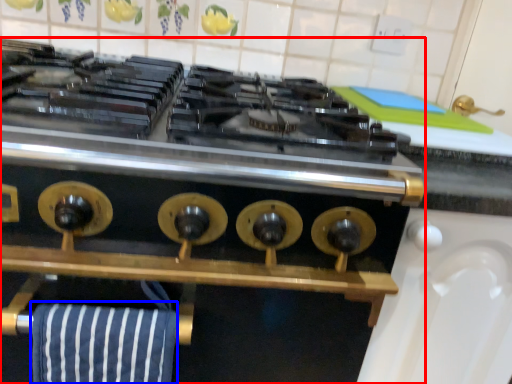
Question: Among these objects, which one is farthest to the camera, kitchen appliance (highlighted by a red box) or beach towel (highlighted by a blue box)?

Choices:
 (A) kitchen appliance
 (B) beach towel

Answer: (B)